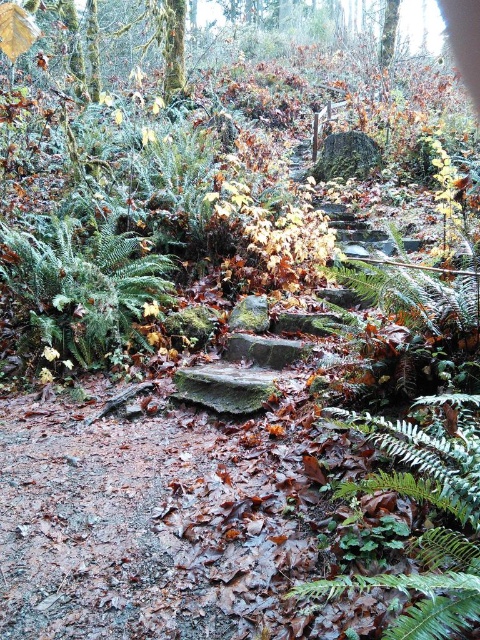
Question: Does green matte fern at center come in front of green matte fern at left?

Choices:
 (A) yes
 (B) no

Answer: (A)

Question: Which of the following is the closest to the observer?

Choices:
 (A) (434, 496)
 (B) (61, 292)

Answer: (A)

Question: Is green matte fern at center bigger than green matte fern at left?

Choices:
 (A) yes
 (B) no

Answer: (B)

Question: Which of the following is the closest to the observer?

Choices:
 (A) (478, 595)
 (B) (59, 250)

Answer: (A)

Question: Which point is closer to the camera taking this photo?

Choices:
 (A) (444, 529)
 (B) (52, 273)

Answer: (A)

Question: Does green matte fern at center have a greater width compared to green matte fern at left?

Choices:
 (A) no
 (B) yes

Answer: (A)